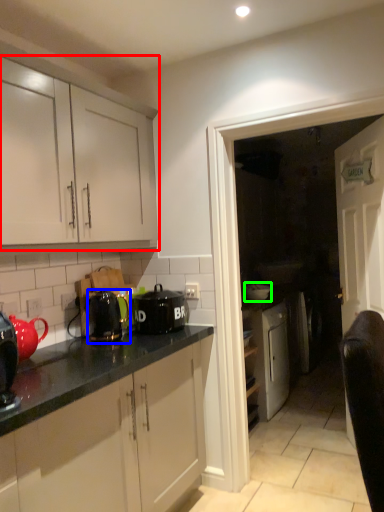
Question: Which object is the closest to the cabinetry (highlighted by a red box)? Choose among these: kitchen appliance (highlighted by a blue box) or appliance (highlighted by a green box).

Choices:
 (A) kitchen appliance
 (B) appliance

Answer: (A)